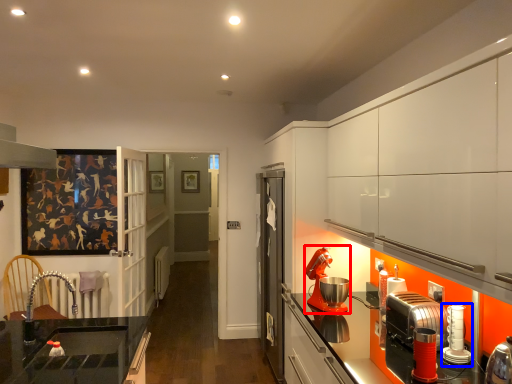
Question: Which of the following is the farthest to the observer, kitchen appliance (highlighted by a red box) or kitchen appliance (highlighted by a blue box)?

Choices:
 (A) kitchen appliance
 (B) kitchen appliance

Answer: (A)